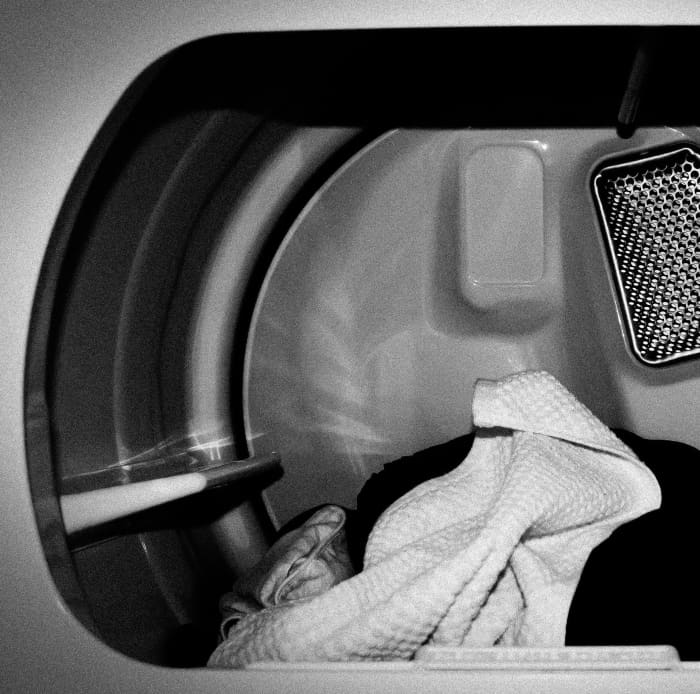
Find the location of a particular element. The image size is (700, 694). outside area of dryer is located at coordinates (43, 135), (52, 617).